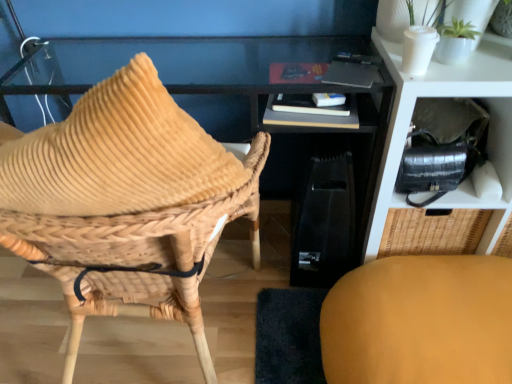
How much space does matte yellow cushion at lower right, positioned as the 2th chair in left-to-right order, occupy vertically?

matte yellow cushion at lower right, positioned as the 2th chair in left-to-right order, is 9.62 inches tall.

Describe the element at coordinates (448, 96) in the screenshot. I see `matte black shelf at upper right` at that location.

Where is `matte black shelf at upper right`? matte black shelf at upper right is located at coordinates (448, 96).

Describe the element at coordinates (308, 113) in the screenshot. The image size is (512, 384). I see `hardcover book at center` at that location.

You are a GUI agent. You are given a task and a screenshot of the screen. Output one action in this format:
    pyautogui.click(x=<x>, y=<y>)
    Task: Click on the woven wood chair at left, arranged as the first chair when viewed from the left
    The height and width of the screenshot is (384, 512).
    Given the screenshot: What is the action you would take?
    pyautogui.click(x=126, y=203)

What's the angular difference between matte yellow cushion at lower right, positioned as the 2th chair in left-to-right order, and matte black shelf at upper right's facing directions?

The facing directions of matte yellow cushion at lower right, positioned as the 2th chair in left-to-right order, and matte black shelf at upper right are 89.9 degrees apart.

Consider the image. From a real-world perspective, is matte yellow cushion at lower right, positioned as the 2th chair in left-to-right order, physically located above or below matte black shelf at upper right?

Clearly, from a real-world perspective, matte yellow cushion at lower right, positioned as the 2th chair in left-to-right order, is below matte black shelf at upper right.

Is matte yellow cushion at lower right, positioned as the 2th chair in left-to-right order, situated inside matte black shelf at upper right or outside?

matte yellow cushion at lower right, positioned as the 2th chair in left-to-right order, is located beyond the bounds of matte black shelf at upper right.

Considering the sizes of objects matte yellow cushion at lower right, the first chair when ordered from right to left, and matte black shelf at upper right in the image provided, who is smaller, matte yellow cushion at lower right, the first chair when ordered from right to left, or matte black shelf at upper right?

Smaller between the two is matte yellow cushion at lower right, the first chair when ordered from right to left.

Does hardcover book at center appear on the right side of matte black shelf at upper right?

In fact, hardcover book at center is to the left of matte black shelf at upper right.

Is hardcover book at center far from matte black shelf at upper right?

hardcover book at center is near matte black shelf at upper right, not far away.

What are the coordinates of `shelf below the hardcover book at center (from the image's perspective)` in the screenshot? It's located at (448, 96).

Could you tell me if woven wood chair at left, which is the second chair from right to left, is facing hardcover book at center?

No, woven wood chair at left, which is the second chair from right to left, does not turn towards hardcover book at center.

Is woven wood chair at left, arranged as the first chair when viewed from the left, wider than hardcover book at center?

Yes, woven wood chair at left, arranged as the first chair when viewed from the left, is wider than hardcover book at center.

From the image's perspective, is woven wood chair at left, which is the second chair from right to left, positioned above or below hardcover book at center?

From the image's perspective, woven wood chair at left, which is the second chair from right to left, appears below hardcover book at center.

From a real-world perspective, is matte black shelf at upper right located higher than matte yellow cushion at lower right, positioned as the 2th chair in left-to-right order?

Yes, from a real-world perspective, matte black shelf at upper right is above matte yellow cushion at lower right, positioned as the 2th chair in left-to-right order.

Locate an element on the screen. This screenshot has height=384, width=512. shelf on the right of the matte yellow cushion at lower right, the first chair when ordered from right to left is located at coordinates point(448,96).

From the image's perspective, which is below, hardcover book at center or matte yellow cushion at lower right, the first chair when ordered from right to left?

matte yellow cushion at lower right, the first chair when ordered from right to left, appears lower in the image.

There is a hardcover book at center. Where is `the 2nd chair below it (from the image's perspective)`? The width and height of the screenshot is (512, 384). the 2nd chair below it (from the image's perspective) is located at coordinates 420,321.

Looking at this image, from a real-world perspective, who is located lower, matte black shelf at upper right or woven wood chair at left, which is the second chair from right to left?

From a 3D spatial view, matte black shelf at upper right is below.

Which is behind, point (492, 119) or point (204, 339)?

Point (492, 119)

Could you tell me if matte black shelf at upper right is facing woven wood chair at left, which is the second chair from right to left?

No.

Is matte black shelf at upper right positioned beyond the bounds of woven wood chair at left, arranged as the first chair when viewed from the left?

That's correct, matte black shelf at upper right is outside of woven wood chair at left, arranged as the first chair when viewed from the left.

Between matte black shelf at upper right and hardcover book at center, which one has larger width?

matte black shelf at upper right is wider.

Which object is positioned more to the left, matte black shelf at upper right or hardcover book at center?

From the viewer's perspective, hardcover book at center appears more on the left side.

Which object is closer to the camera, matte black shelf at upper right or hardcover book at center?

matte black shelf at upper right is closer to the camera.

Is hardcover book at center at the back of matte black shelf at upper right?

That's not correct — matte black shelf at upper right is not looking away from hardcover book at center.

The height and width of the screenshot is (384, 512). I want to click on the 2nd chair below the matte black shelf at upper right (from the image's perspective), so click(420, 321).

Locate an element on the screen. The height and width of the screenshot is (384, 512). book that is on the left side of matte black shelf at upper right is located at coordinates (308, 113).

Based on their spatial positions, is hardcover book at center or matte yellow cushion at lower right, positioned as the 2th chair in left-to-right order, further from matte black shelf at upper right?

→ matte yellow cushion at lower right, positioned as the 2th chair in left-to-right order.

From the image, which object appears to be nearer to hardcover book at center, woven wood chair at left, which is the second chair from right to left, or matte yellow cushion at lower right, the first chair when ordered from right to left?

Based on the image, woven wood chair at left, which is the second chair from right to left, appears to be nearer to hardcover book at center.

Looking at the image, which one is located closer to matte black shelf at upper right, matte yellow cushion at lower right, positioned as the 2th chair in left-to-right order, or hardcover book at center?

Among the two, hardcover book at center is located nearer to matte black shelf at upper right.

From the image, which object appears to be farther from matte yellow cushion at lower right, positioned as the 2th chair in left-to-right order, hardcover book at center or matte black shelf at upper right?

Based on the image, hardcover book at center appears to be further to matte yellow cushion at lower right, positioned as the 2th chair in left-to-right order.

Which object lies nearer to the anchor point matte yellow cushion at lower right, the first chair when ordered from right to left, woven wood chair at left, arranged as the first chair when viewed from the left, or matte black shelf at upper right?

Based on the image, matte black shelf at upper right appears to be nearer to matte yellow cushion at lower right, the first chair when ordered from right to left.

Which object lies nearer to the anchor point matte black shelf at upper right, hardcover book at center or woven wood chair at left, which is the second chair from right to left?

hardcover book at center is positioned closer to the anchor matte black shelf at upper right.

Estimate the real-world distances between objects in this image. Which object is closer to matte yellow cushion at lower right, positioned as the 2th chair in left-to-right order, woven wood chair at left, arranged as the first chair when viewed from the left, or hardcover book at center?

hardcover book at center lies closer to matte yellow cushion at lower right, positioned as the 2th chair in left-to-right order, than the other object.

Based on their spatial positions, is matte black shelf at upper right or hardcover book at center closer to matte yellow cushion at lower right, positioned as the 2th chair in left-to-right order?

matte black shelf at upper right lies closer to matte yellow cushion at lower right, positioned as the 2th chair in left-to-right order, than the other object.

Locate an element on the screen. The image size is (512, 384). chair between woven wood chair at left, arranged as the first chair when viewed from the left, and matte black shelf at upper right from left to right is located at coordinates (420, 321).

This screenshot has width=512, height=384. Identify the location of book between woven wood chair at left, which is the second chair from right to left, and matte yellow cushion at lower right, the first chair when ordered from right to left, in the horizontal direction. (308, 113).

The width and height of the screenshot is (512, 384). What are the coordinates of `shelf between hardcover book at center and matte yellow cushion at lower right, the first chair when ordered from right to left, in the vertical direction` in the screenshot? It's located at (448, 96).

Locate an element on the screen. This screenshot has height=384, width=512. book between woven wood chair at left, arranged as the first chair when viewed from the left, and matte black shelf at upper right is located at coordinates (308, 113).